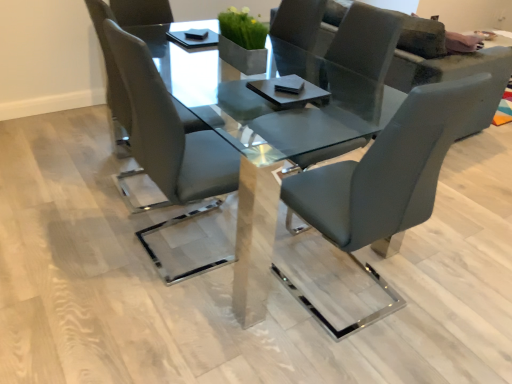
Locate an element on the screen. Image resolution: width=512 pixels, height=384 pixels. vacant space underneath matte gray chair at center, placed as the 1th chair when sorted from right to left (from a real-world perspective) is located at coordinates (351, 294).